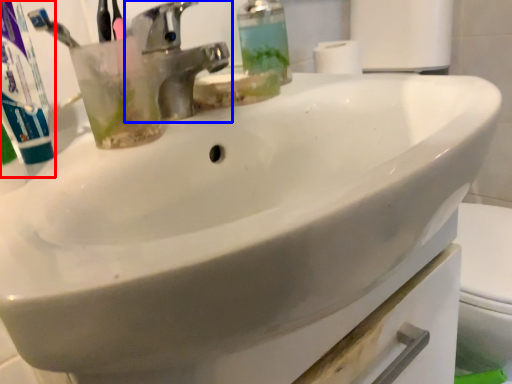
Question: Which object is further to the camera taking this photo, toothpaste (highlighted by a red box) or tap (highlighted by a blue box)?

Choices:
 (A) toothpaste
 (B) tap

Answer: (B)